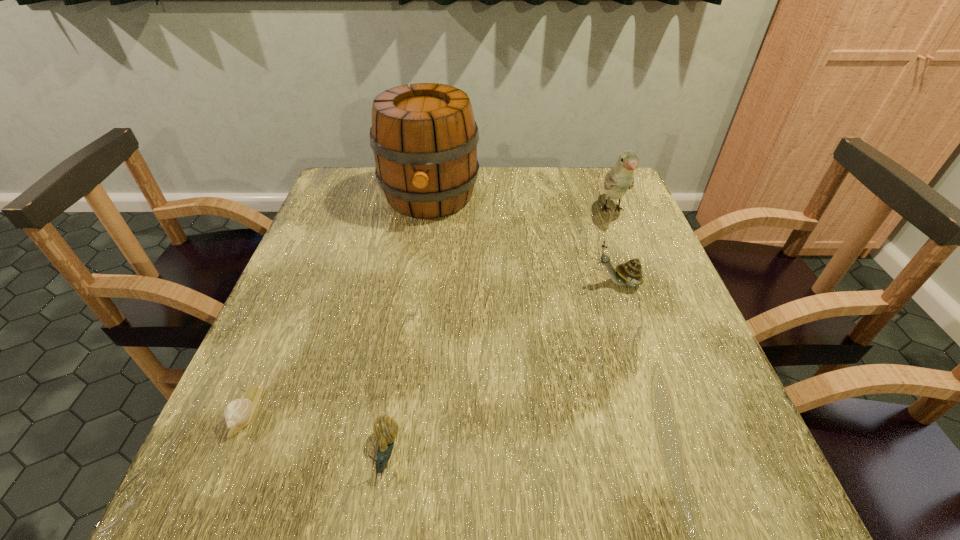
At what (x,y) coordinates should I click in order to perform the action: click on the closest escargot to the second escargot from right to left. Please return your answer as a coordinate pair (x, y). The height and width of the screenshot is (540, 960). Looking at the image, I should click on (238, 413).

Identify which escargot is the second nearest to the second escargot from right to left. Please provide its 2D coordinates. Your answer should be formatted as a tuple, i.e. [(x, y)], where the tuple contains the x and y coordinates of a point satisfying the conditions above.

[(630, 273)]

Locate an element on the screen. vacant space that satisfies the following two spatial constraints: 1. on the face of the farthest escargot; 2. on the shell of the leftmost escargot is located at coordinates (660, 410).

This screenshot has width=960, height=540. Find the location of `vacant region that satisfies the following two spatial constraints: 1. on the face of the tallest escargot; 2. on the shell of the shortest escargot`. vacant region that satisfies the following two spatial constraints: 1. on the face of the tallest escargot; 2. on the shell of the shortest escargot is located at coordinates (660, 410).

Where is `vacant region that satisfies the following two spatial constraints: 1. on the face of the tallest escargot; 2. on the shell of the leftmost escargot`? This screenshot has height=540, width=960. vacant region that satisfies the following two spatial constraints: 1. on the face of the tallest escargot; 2. on the shell of the leftmost escargot is located at coordinates point(660,410).

Image resolution: width=960 pixels, height=540 pixels. Find the location of `vacant space that satisfies the following two spatial constraints: 1. on the face of the rightmost escargot; 2. on the shell of the leftmost object`. vacant space that satisfies the following two spatial constraints: 1. on the face of the rightmost escargot; 2. on the shell of the leftmost object is located at coordinates (660, 410).